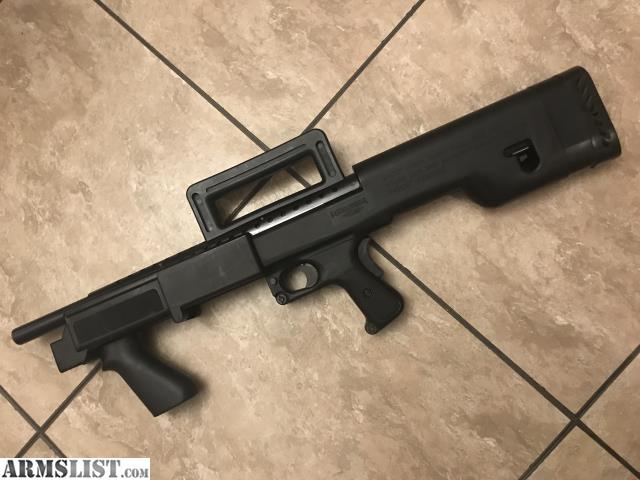
Where is `cement spaces between floor tiles`? Image resolution: width=640 pixels, height=480 pixels. cement spaces between floor tiles is located at coordinates (29, 416), (59, 410), (225, 111), (363, 62), (473, 331), (605, 391), (608, 448), (539, 461), (56, 449), (24, 445).